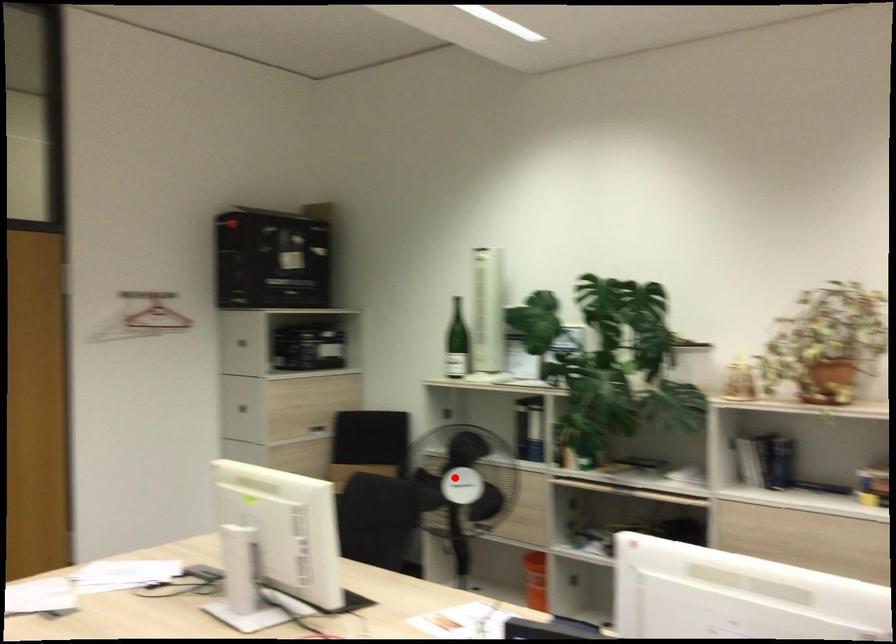
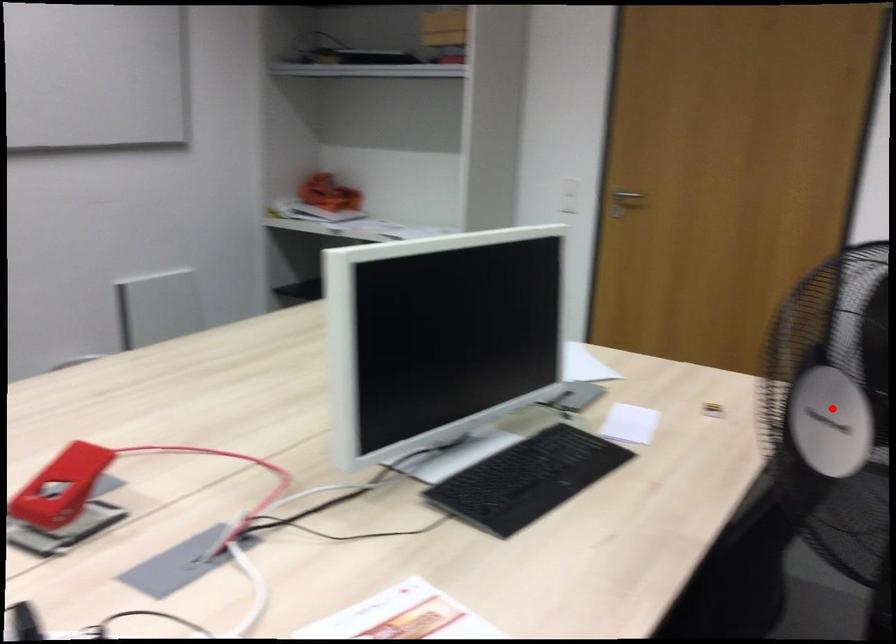
I am providing you with two images of the same scene from different viewpoints. A red point is marked on the first image and another point is marked on the second image. Is the marked point in image1 the same physical position as the marked point in image2?

Yes